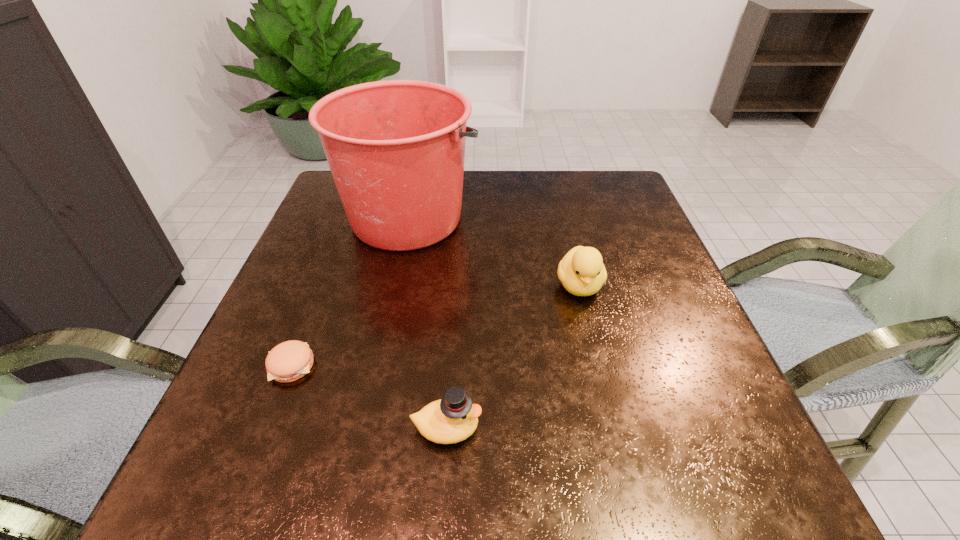
Locate an element on the screen. The width and height of the screenshot is (960, 540). empty location between the nearest object and the patty is located at coordinates (369, 396).

Locate an element on the screen. The height and width of the screenshot is (540, 960). blank region between the second farthest object and the tallest object is located at coordinates (494, 252).

Identify the location of vacant space in between the tallest object and the third tallest object. (428, 323).

Identify which object is the third nearest to the nearer duck. Please provide its 2D coordinates. Your answer should be formatted as a tuple, i.e. [(x, y)], where the tuple contains the x and y coordinates of a point satisfying the conditions above.

[(396, 148)]

Point out which object is positioned as the third nearest to the patty. Please provide its 2D coordinates. Your answer should be formatted as a tuple, i.e. [(x, y)], where the tuple contains the x and y coordinates of a point satisfying the conditions above.

[(582, 272)]

Find the location of a particular element. vacant point that satisfies the following two spatial constraints: 1. on the front-facing side of the rightmost object; 2. on the front-facing side of the left duck is located at coordinates (614, 428).